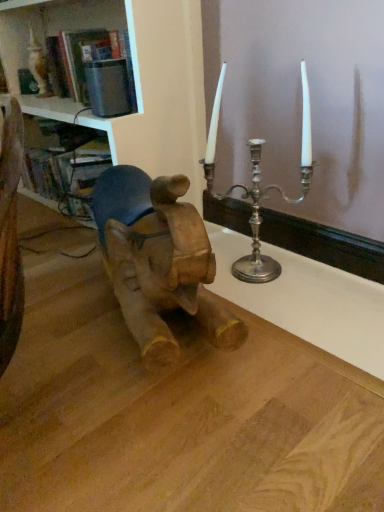
Question: Are wooden baby elephant at left and wooden table at center located far from each other?

Choices:
 (A) yes
 (B) no

Answer: (B)

Question: Considering the relative sizes of wooden baby elephant at left and wooden table at center in the image provided, is wooden baby elephant at left shorter than wooden table at center?

Choices:
 (A) yes
 (B) no

Answer: (B)

Question: Can you confirm if wooden baby elephant at left is positioned to the right of wooden table at center?

Choices:
 (A) yes
 (B) no

Answer: (A)

Question: Could you tell me if wooden baby elephant at left is turned towards wooden table at center?

Choices:
 (A) yes
 (B) no

Answer: (B)

Question: From the image's perspective, is wooden baby elephant at left located beneath wooden table at center?

Choices:
 (A) yes
 (B) no

Answer: (B)

Question: Considering the positions of wooden table at center and wooden baby elephant at left in the image, is wooden table at center taller or shorter than wooden baby elephant at left?

Choices:
 (A) tall
 (B) short

Answer: (B)

Question: From the image's perspective, is wooden table at center above or below wooden baby elephant at left?

Choices:
 (A) below
 (B) above

Answer: (A)

Question: From a real-world perspective, relative to wooden baby elephant at left, is wooden table at center vertically above or below?

Choices:
 (A) above
 (B) below

Answer: (B)

Question: Is point (150, 480) positioned closer to the camera than point (157, 284)?

Choices:
 (A) closer
 (B) farther

Answer: (A)

Question: From the image's perspective, is white glossy bookshelf at upper left positioned above or below wooden table at center?

Choices:
 (A) below
 (B) above

Answer: (B)

Question: Is point (148, 139) closer or farther from the camera than point (134, 426)?

Choices:
 (A) farther
 (B) closer

Answer: (A)

Question: Considering the positions of white glossy bookshelf at upper left and wooden table at center in the image, is white glossy bookshelf at upper left wider or thinner than wooden table at center?

Choices:
 (A) thin
 (B) wide

Answer: (A)

Question: Is white glossy bookshelf at upper left to the left or to the right of wooden table at center in the image?

Choices:
 (A) left
 (B) right

Answer: (A)

Question: In terms of size, does wooden baby elephant at left appear bigger or smaller than wooden table at center?

Choices:
 (A) small
 (B) big

Answer: (A)

Question: Does point (107, 198) appear closer or farther from the camera than point (64, 276)?

Choices:
 (A) farther
 (B) closer

Answer: (B)